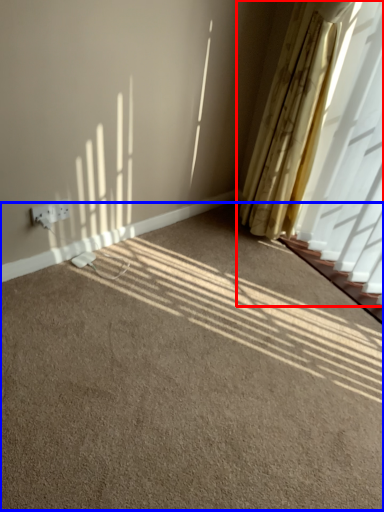
Question: Which of the following is the closest to the observer, curtain (highlighted by a red box) or plain (highlighted by a blue box)?

Choices:
 (A) curtain
 (B) plain

Answer: (B)